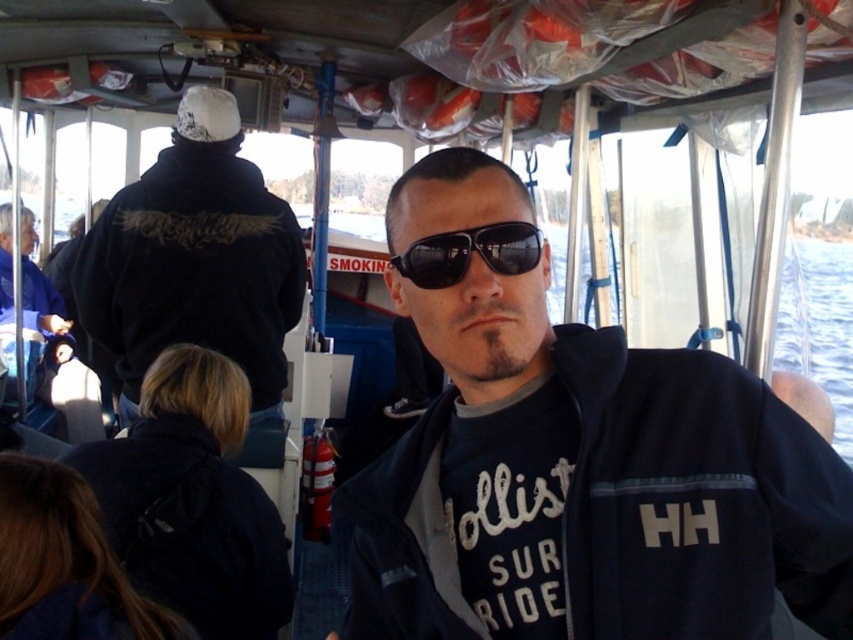
Is point (573, 410) behind point (239, 349)?

No.

Is navy blue jacket at center shorter than black fleece jacket at upper left?

Correct, navy blue jacket at center is not as tall as black fleece jacket at upper left.

Between point (659, 602) and point (231, 104), which one is positioned behind?

The point (231, 104) is more distant.

Find the location of a particular element. This screenshot has width=853, height=640. navy blue jacket at center is located at coordinates (585, 484).

Is navy blue jacket at center above black reflective sunglasses at center?

Actually, navy blue jacket at center is below black reflective sunglasses at center.

Describe the element at coordinates (585, 484) in the screenshot. Image resolution: width=853 pixels, height=640 pixels. I see `navy blue jacket at center` at that location.

Where is `navy blue jacket at center`? This screenshot has height=640, width=853. navy blue jacket at center is located at coordinates (585, 484).

Is black fleece jacket at upper left above black reflective sunglasses at center?

Yes, black fleece jacket at upper left is above black reflective sunglasses at center.

Is black fleece jacket at upper left taller than black reflective sunglasses at center?

Correct, black fleece jacket at upper left is much taller as black reflective sunglasses at center.

The image size is (853, 640). Find the location of `black fleece jacket at upper left`. black fleece jacket at upper left is located at coordinates (194, 259).

At what (x,y) coordinates should I click in order to perform the action: click on black fleece jacket at upper left. Please return your answer as a coordinate pair (x, y). Looking at the image, I should click on (194, 259).